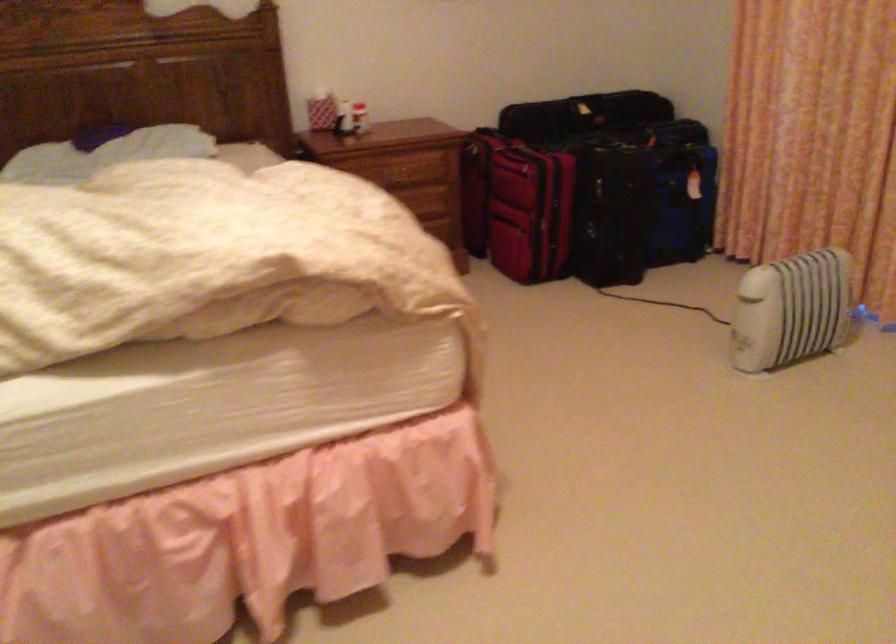
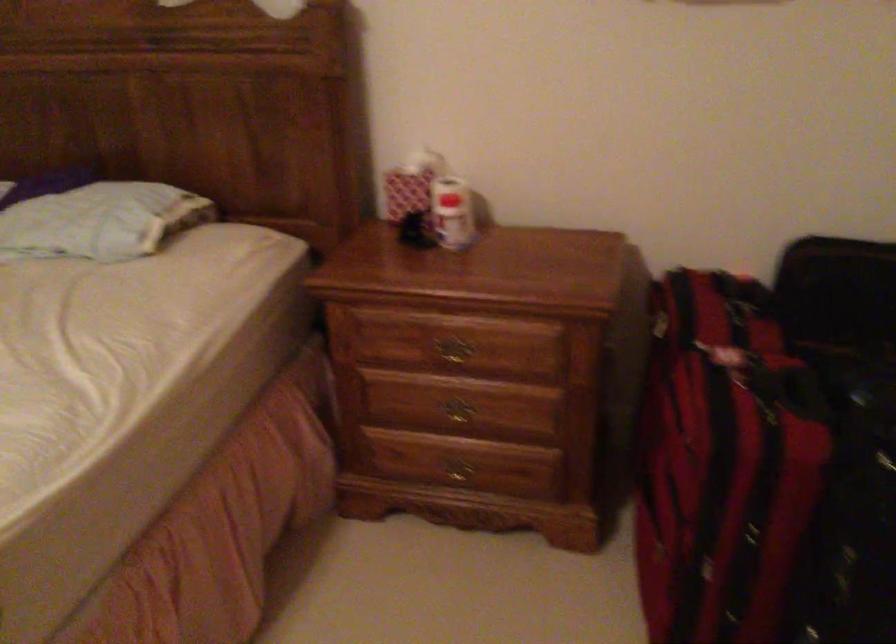
Find the pixel in the second image that matches the point at 357,106 in the first image.

(452, 213)